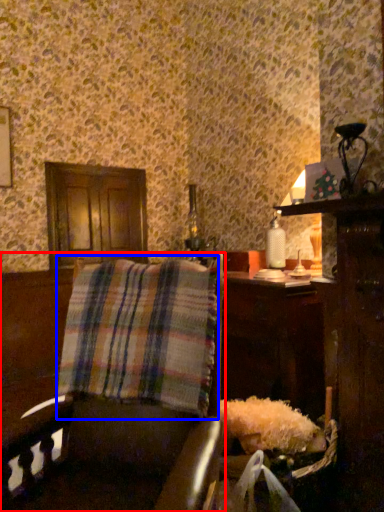
Question: Which object appears farthest to the camera in this image, furniture (highlighted by a red box) or plaid (highlighted by a blue box)?

Choices:
 (A) furniture
 (B) plaid

Answer: (B)